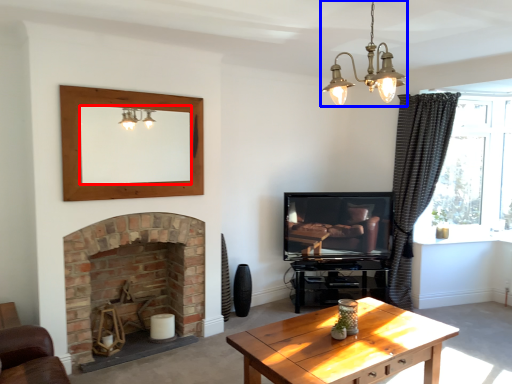
Question: Which object appears farthest to the camera in this image, mirror (highlighted by a red box) or light fixture (highlighted by a blue box)?

Choices:
 (A) mirror
 (B) light fixture

Answer: (A)